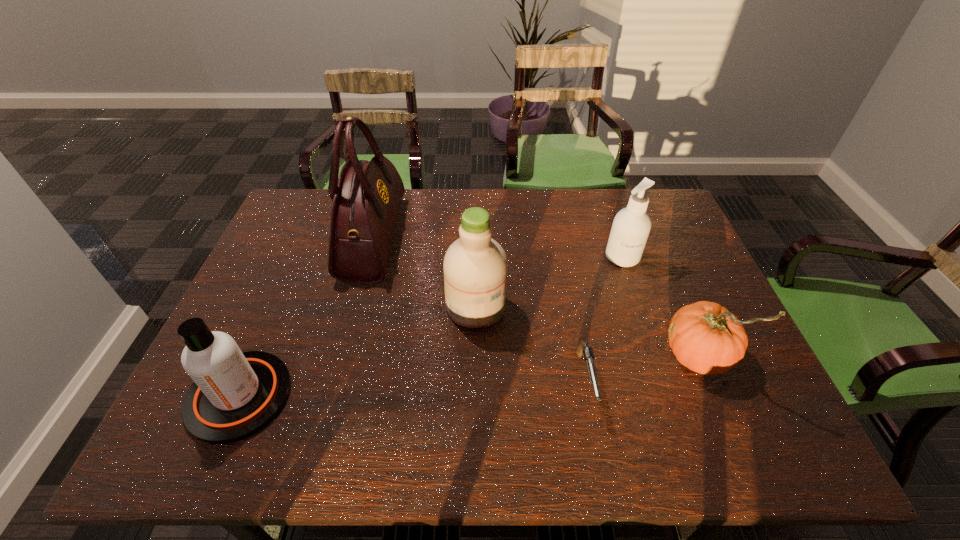
Image resolution: width=960 pixels, height=540 pixels. What are the coordinates of `free spot that satisfies the following two spatial constraints: 1. on the front label of the pumpkin; 2. on the right side of the fourth object from right to left` in the screenshot? It's located at [x=475, y=353].

At what (x,y) coordinates should I click in order to perform the action: click on free location that satisfies the following two spatial constraints: 1. on the front-facing side of the fifth object from right to left; 2. on the front side of the nearest cleansing agent. Please return your answer as a coordinate pair (x, y). Looking at the image, I should click on (331, 396).